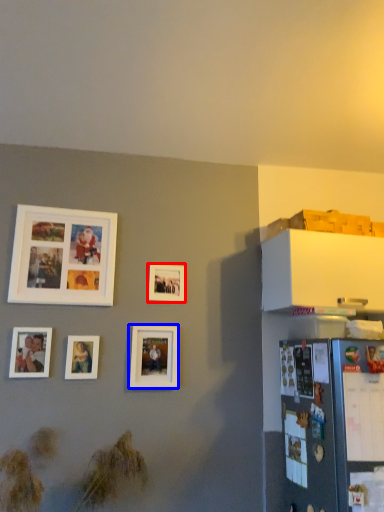
Question: Which object is further to the camera taking this photo, picture frame (highlighted by a red box) or picture frame (highlighted by a blue box)?

Choices:
 (A) picture frame
 (B) picture frame

Answer: (A)